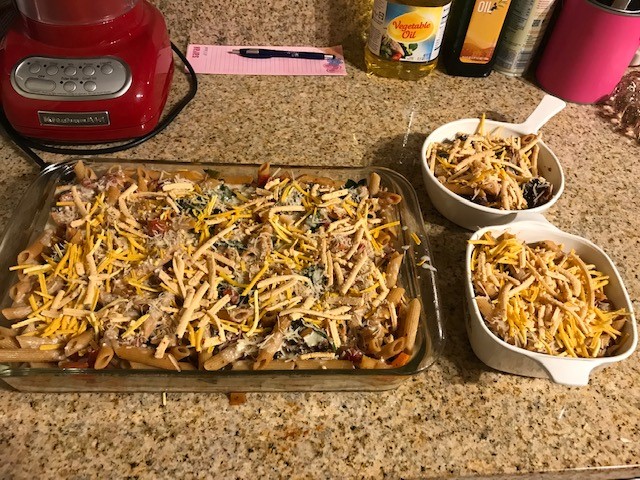
Where is `notepad`? The width and height of the screenshot is (640, 480). notepad is located at coordinates (285, 64).